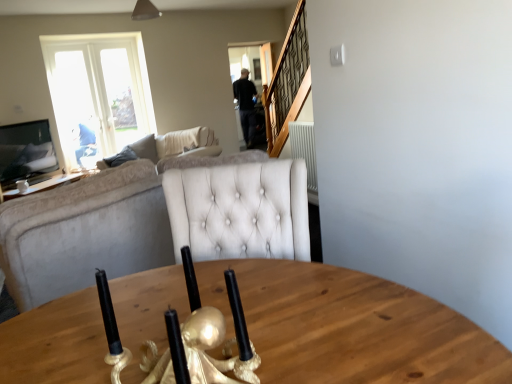
Question: Considering the relative positions of beige fabric couch at left, which appears as the 2th studio couch when viewed from the front, and velvet beige couch at left, acting as the first studio couch starting from the bottom, in the image provided, is beige fabric couch at left, which appears as the 2th studio couch when viewed from the front, to the left or to the right of velvet beige couch at left, acting as the first studio couch starting from the bottom,?

Choices:
 (A) right
 (B) left

Answer: (B)

Question: In terms of width, does beige fabric couch at left, acting as the first studio couch starting from the back, look wider or thinner when compared to velvet beige couch at left, which is the 2th studio couch in top-to-bottom order?

Choices:
 (A) thin
 (B) wide

Answer: (B)

Question: Which is farther from the transparent glass door at upper center?

Choices:
 (A) white ceramic coffee cup at upper left
 (B) velvet beige couch at left, which is the 2th studio couch in top-to-bottom order
 (C) beige fabric couch at left, which appears as the 2th studio couch when viewed from the front

Answer: (B)

Question: Which object is the closest to the beige fabric couch at left, arranged as the second studio couch when ordered from the bottom?

Choices:
 (A) transparent glass door at upper center
 (B) white ceramic coffee cup at upper left
 (C) velvet beige couch at left, the first studio couch in the front-to-back sequence

Answer: (C)